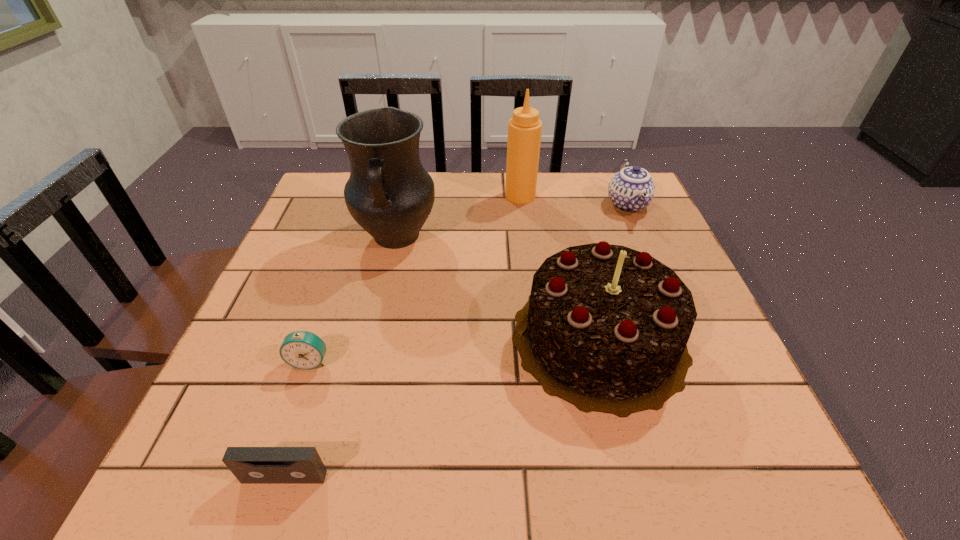
The width and height of the screenshot is (960, 540). Find the location of `object that is at the far left corner`. object that is at the far left corner is located at coordinates point(389,194).

You are a GUI agent. You are given a task and a screenshot of the screen. Output one action in this format:
    pyautogui.click(x=<x>, y=<y>)
    Task: Click on the object located in the near left corner section of the desktop
    This screenshot has height=540, width=960.
    Given the screenshot: What is the action you would take?
    pyautogui.click(x=250, y=465)

Identify the location of object that is at the far right corner. (631, 189).

You are a GUI agent. You are given a task and a screenshot of the screen. Output one action in this format:
    pyautogui.click(x=<x>, y=<y>)
    Task: Click on the vacant region at the far edge of the desktop
    The width and height of the screenshot is (960, 540).
    Given the screenshot: What is the action you would take?
    pyautogui.click(x=504, y=188)

Where is `vacant space at the near edge of the desktop`? vacant space at the near edge of the desktop is located at coordinates (558, 475).

The image size is (960, 540). In order to click on free space at the right edge of the desktop in this screenshot , I will do `click(705, 343)`.

Where is `vacant space at the far left corner`? Image resolution: width=960 pixels, height=540 pixels. vacant space at the far left corner is located at coordinates click(x=336, y=190).

Where is `vacant space at the near right corner of the desktop`? The image size is (960, 540). vacant space at the near right corner of the desktop is located at coordinates (760, 455).

Find the location of a particular element. The height and width of the screenshot is (540, 960). unoccupied position between the pitcher and the condiment is located at coordinates (458, 216).

Locate an element on the screen. free space between the condiment and the nearest object is located at coordinates (402, 336).